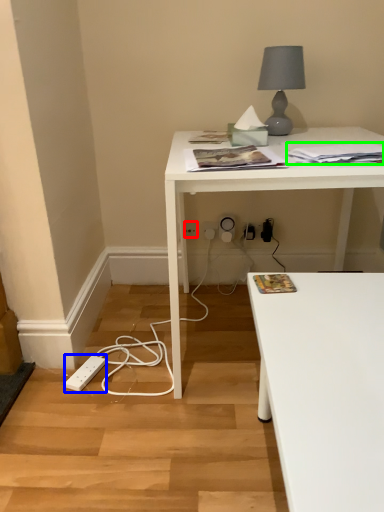
Question: Which is nearer to the electric outlet (highlighted by a red box)? extension cord (highlighted by a blue box) or magazine (highlighted by a green box).

Choices:
 (A) extension cord
 (B) magazine

Answer: (A)